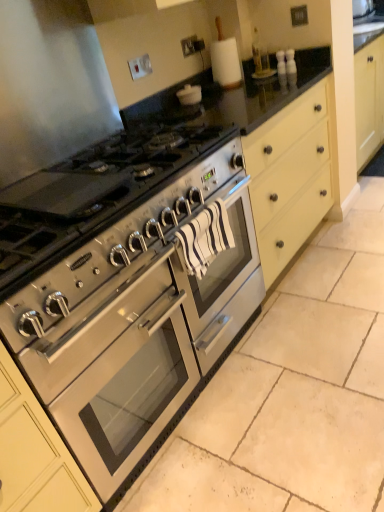
Question: From the image's perspective, would you say stainless steel oven at center is shown under satin silver gas stove at center?

Choices:
 (A) yes
 (B) no

Answer: (A)

Question: Can you confirm if stainless steel oven at center is wider than satin silver gas stove at center?

Choices:
 (A) no
 (B) yes

Answer: (B)

Question: From a real-world perspective, is stainless steel oven at center over satin silver gas stove at center?

Choices:
 (A) yes
 (B) no

Answer: (B)

Question: From the image's perspective, is stainless steel oven at center located above satin silver gas stove at center?

Choices:
 (A) yes
 (B) no

Answer: (B)

Question: From a real-world perspective, is stainless steel oven at center physically below satin silver gas stove at center?

Choices:
 (A) no
 (B) yes

Answer: (B)

Question: Would you say satin silver gas stove at center is part of stainless steel oven at center's contents?

Choices:
 (A) no
 (B) yes

Answer: (A)

Question: Does satin silver gas stove at center have a larger size compared to stainless steel oven at center?

Choices:
 (A) yes
 (B) no

Answer: (B)

Question: From the image's perspective, would you say satin silver gas stove at center is shown under stainless steel oven at center?

Choices:
 (A) no
 (B) yes

Answer: (A)

Question: Considering the relative sizes of satin silver gas stove at center and stainless steel oven at center in the image provided, is satin silver gas stove at center thinner than stainless steel oven at center?

Choices:
 (A) yes
 (B) no

Answer: (A)

Question: Is stainless steel oven at center surrounded by satin silver gas stove at center?

Choices:
 (A) no
 (B) yes

Answer: (A)

Question: Is satin silver gas stove at center to the right of stainless steel oven at center from the viewer's perspective?

Choices:
 (A) no
 (B) yes

Answer: (A)

Question: Could you tell me if satin silver gas stove at center is turned towards stainless steel oven at center?

Choices:
 (A) no
 (B) yes

Answer: (A)

Question: Considering the positions of point click(x=56, y=400) and point click(x=57, y=209), is point click(x=56, y=400) closer or farther from the camera than point click(x=57, y=209)?

Choices:
 (A) closer
 (B) farther

Answer: (A)